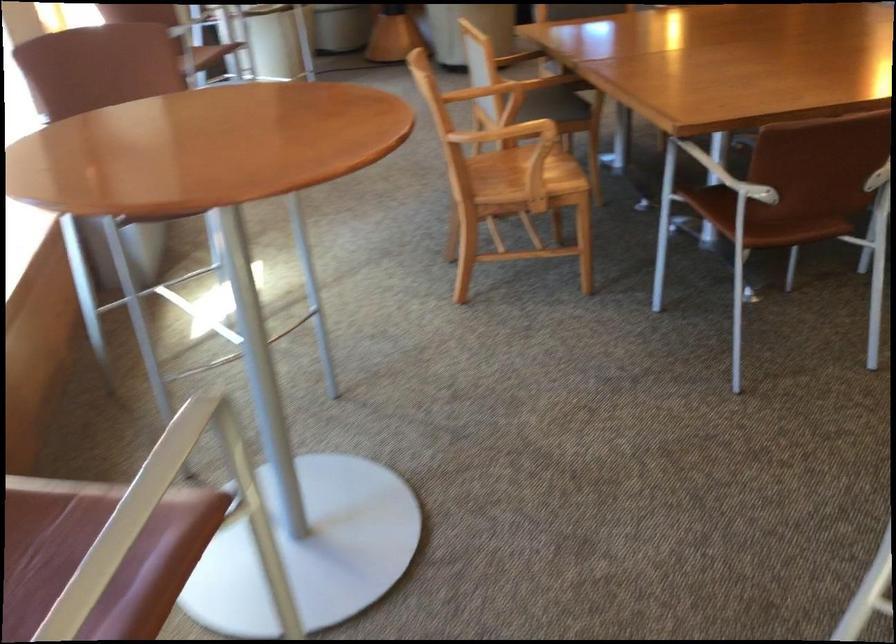
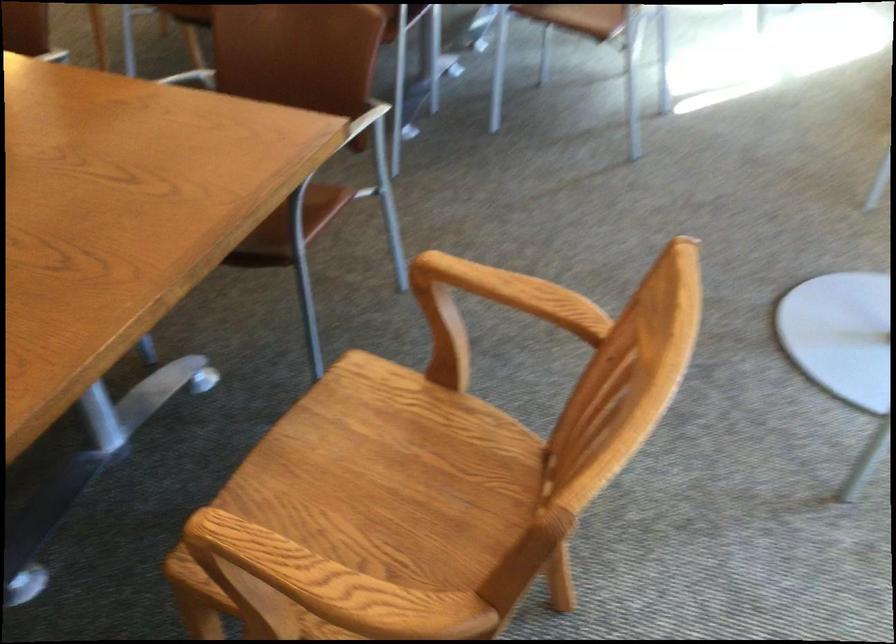
Question: I am providing you with two images of the same scene from different viewpoints. Please identify which objects are invisible in image2.

Choices:
 (A) wooden chair sitting surface
 (B) wooden bread box
 (C) wooden chair armrest
 (D) brown chair sitting surface

Answer: (D)